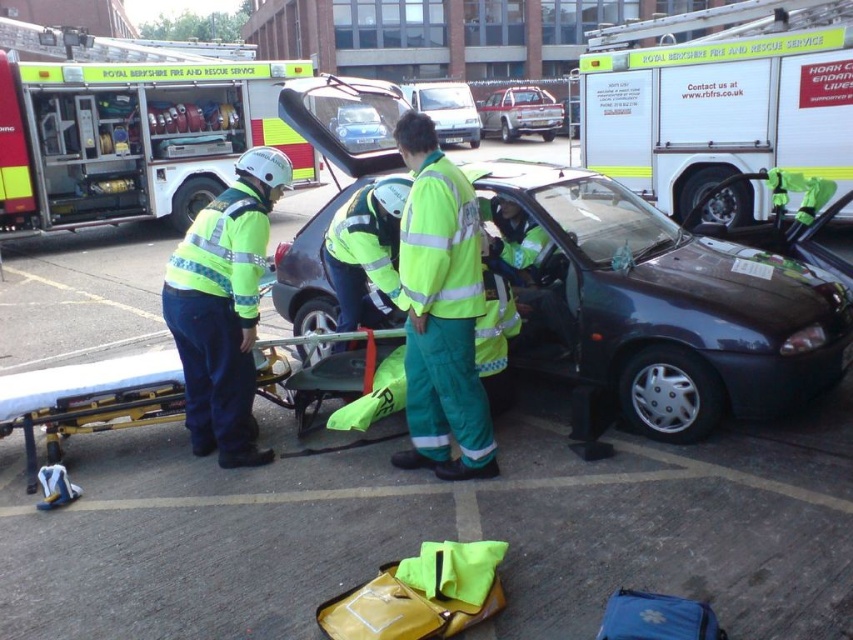
Question: Among these points, which one is farthest from the camera?

Choices:
 (A) (363, 212)
 (B) (88, 426)
 (C) (471, 145)
 (D) (128, 38)

Answer: (D)

Question: Is yellow fabric stretcher at lower left smaller than green reflective jacket at center?

Choices:
 (A) no
 (B) yes

Answer: (B)

Question: Which point is farther from the camera taking this photo?

Choices:
 (A) (436, 316)
 (B) (415, 83)
 (C) (107, 51)

Answer: (B)

Question: Is shiny dark car at center smaller than fire engine at left?

Choices:
 (A) yes
 (B) no

Answer: (A)

Question: Does shiny dark car at center have a lesser width compared to white glossy fire truck at upper center?

Choices:
 (A) yes
 (B) no

Answer: (A)

Question: Which object is the closest to the high-visibility fabric uniform at center?

Choices:
 (A) metallic silver pickup truck at center
 (B) white glossy fire truck at upper center
 (C) metallic blue car at center
 (D) yellow fabric stretcher at lower left

Answer: (C)